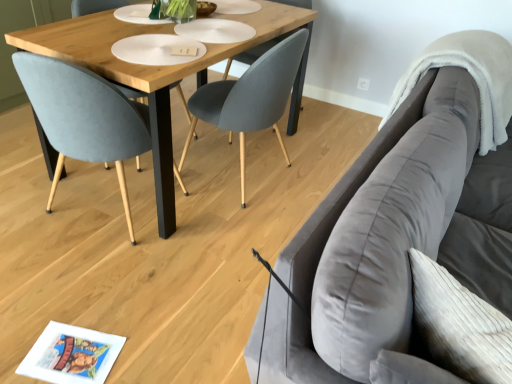
Locate an element on the screen. This screenshot has height=384, width=512. free space to the left of velvet blue chair at center, which is counted as the 2th chair, starting from the right is located at coordinates (24, 197).